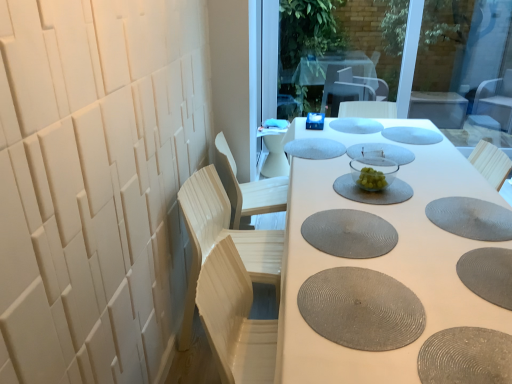
Image resolution: width=512 pixels, height=384 pixels. I want to click on free space underneath clear glass bowl at center, which is the fourth manhole cover in back-to-front order (from a real-world perspective), so click(375, 150).